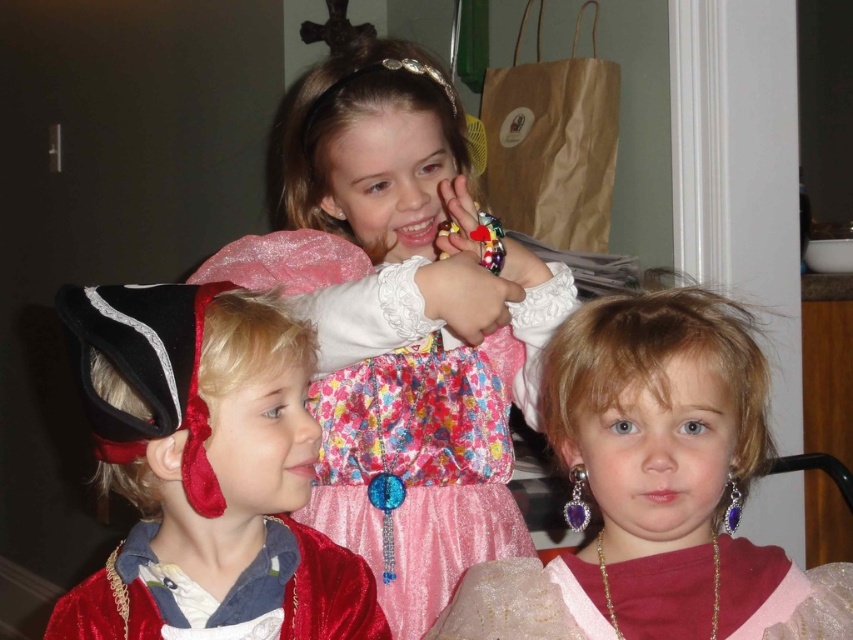
You are a photographer at a costume party. You need to arrange the pink satin dress at center and the pink tulle dress at center so that both are visible in the photo. Which dress should you place closer to the camera to ensure both are fully visible?

The pink satin dress at center is much taller than the pink tulle dress at center. To ensure both are fully visible in the photo, you should place the pink satin dress at center closer to the camera so that the taller dress doesn not block the shorter one.

You are a photographer setting up for a group photo. You have two pink dresses at the center of the scene. Which one is taller, the fluffy pink dress at center or the pink satin dress at center?

The fluffy pink dress at center is taller than the pink satin dress at center according to the description.